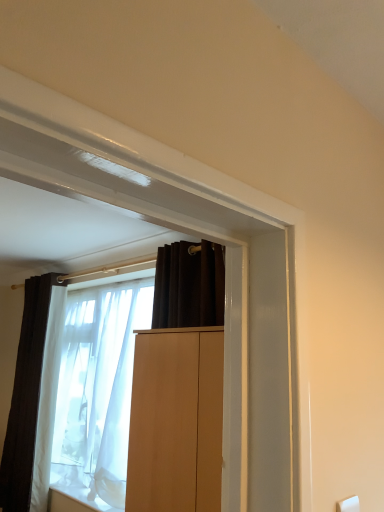
Question: In terms of size, does dark matte curtain at left appear bigger or smaller than translucent fabric window at center?

Choices:
 (A) small
 (B) big

Answer: (A)

Question: Is dark matte curtain at left taller or shorter than translucent fabric window at center?

Choices:
 (A) tall
 (B) short

Answer: (A)

Question: Based on their relative distances, which object is nearer to the white sheer fabric at center?

Choices:
 (A) dark matte curtain at left
 (B) translucent fabric window at center
 (C) light brown wood cabinet at center
 (D) white matte window sill at lower left

Answer: (A)

Question: Which of these objects is positioned farthest from the white matte window sill at lower left?

Choices:
 (A) light brown wood cabinet at center
 (B) dark matte curtain at left
 (C) translucent fabric window at center
 (D) white sheer fabric at center

Answer: (A)